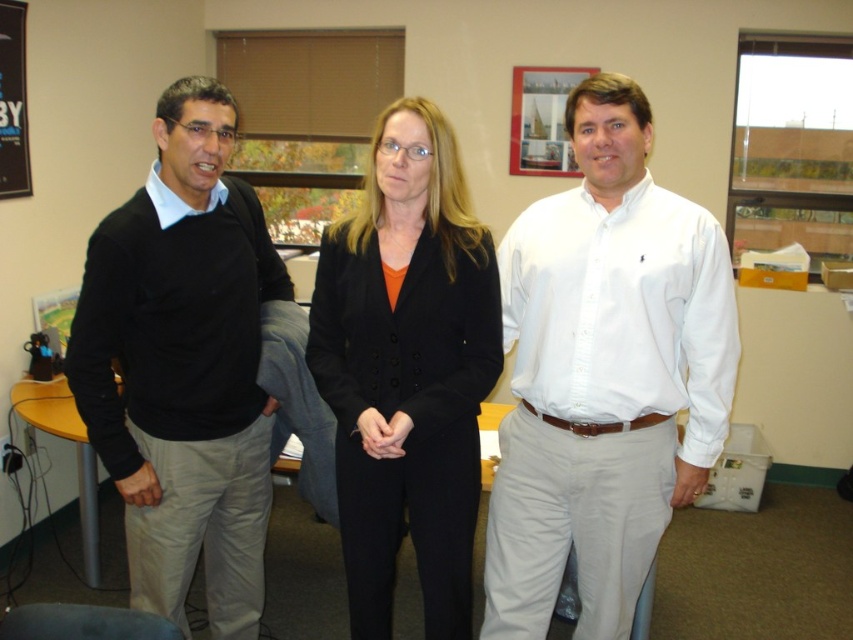
Question: Is black sweater at left wider than black wool suit at center?

Choices:
 (A) yes
 (B) no

Answer: (A)

Question: Is white cotton shirt at center further to camera compared to black sweater at left?

Choices:
 (A) no
 (B) yes

Answer: (B)

Question: Which point is closer to the camera?

Choices:
 (A) pyautogui.click(x=126, y=346)
 (B) pyautogui.click(x=509, y=314)

Answer: (A)

Question: Which point appears farthest from the camera in this image?

Choices:
 (A) (457, 548)
 (B) (90, 337)

Answer: (A)

Question: Which point is closer to the camera taking this photo?

Choices:
 (A) (410, 141)
 (B) (157, 481)
 (C) (708, 227)

Answer: (A)

Question: Is black sweater at left bigger than black wool suit at center?

Choices:
 (A) no
 (B) yes

Answer: (B)